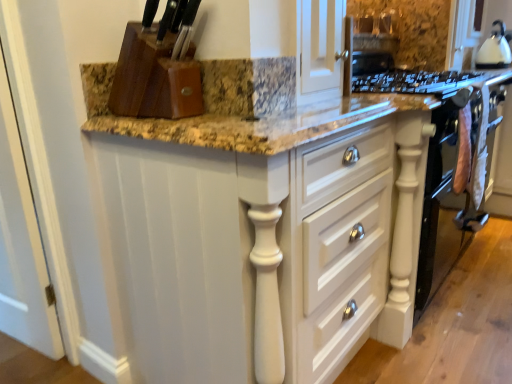
This screenshot has height=384, width=512. I want to click on white glossy kettle at upper right, so click(494, 50).

Image resolution: width=512 pixels, height=384 pixels. What do you see at coordinates (494, 50) in the screenshot? I see `white glossy kettle at upper right` at bounding box center [494, 50].

What is the approximate width of white glossy kettle at upper right?

It is 22.47 centimeters.

The image size is (512, 384). What do you see at coordinates (269, 243) in the screenshot?
I see `white painted wood cabinet at center` at bounding box center [269, 243].

At what (x,y) coordinates should I click in order to perform the action: click on white painted wood cabinet at center. Please return your answer as a coordinate pair (x, y). The height and width of the screenshot is (384, 512). Looking at the image, I should click on 269,243.

Locate an element on the screen. white glossy kettle at upper right is located at coordinates point(494,50).

Is white painted wood cabinet at center to the right of white glossy kettle at upper right from the viewer's perspective?

Incorrect, white painted wood cabinet at center is not on the right side of white glossy kettle at upper right.

Which object is further away from the camera, white painted wood cabinet at center or white glossy kettle at upper right?

white glossy kettle at upper right is further away from the camera.

Which is farther from the camera, (238, 356) or (500, 58)?

The point (500, 58) is farther.

From the image's perspective, is white painted wood cabinet at center above or below white glossy kettle at upper right?

white painted wood cabinet at center is situated lower than white glossy kettle at upper right in the image.

From a real-world perspective, is white painted wood cabinet at center on top of white glossy kettle at upper right?

No, from a real-world perspective, white painted wood cabinet at center is not on top of white glossy kettle at upper right.

Which object is thinner, white painted wood cabinet at center or white glossy kettle at upper right?

Thinner between the two is white glossy kettle at upper right.

In terms of height, does white painted wood cabinet at center look taller or shorter compared to white glossy kettle at upper right?

Clearly, white painted wood cabinet at center is taller compared to white glossy kettle at upper right.

Considering the sizes of white painted wood cabinet at center and white glossy kettle at upper right in the image, is white painted wood cabinet at center bigger or smaller than white glossy kettle at upper right?

In the image, white painted wood cabinet at center appears to be larger than white glossy kettle at upper right.

Is white painted wood cabinet at center surrounding white glossy kettle at upper right?

Definitely not — white glossy kettle at upper right is not inside white painted wood cabinet at center.

Is white painted wood cabinet at center beside white glossy kettle at upper right?

white painted wood cabinet at center and white glossy kettle at upper right are not in contact.

Is white painted wood cabinet at center positioned with its back to white glossy kettle at upper right?

No, white painted wood cabinet at center's orientation is not away from white glossy kettle at upper right.

What's the angular difference between white painted wood cabinet at center and white glossy kettle at upper right's facing directions?

white painted wood cabinet at center and white glossy kettle at upper right are facing 1.22 degrees away from each other.

How far apart are white painted wood cabinet at center and white glossy kettle at upper right?

white painted wood cabinet at center is 2.17 meters away from white glossy kettle at upper right.

I want to click on kitchen appliance above the white painted wood cabinet at center (from the image's perspective), so click(494, 50).

Considering the positions of objects white glossy kettle at upper right and white painted wood cabinet at center in the image provided, who is more to the left, white glossy kettle at upper right or white painted wood cabinet at center?

Positioned to the left is white painted wood cabinet at center.

In the image, is white glossy kettle at upper right positioned in front of or behind white painted wood cabinet at center?

Visually, white glossy kettle at upper right is located behind white painted wood cabinet at center.

Considering the positions of point (490, 43) and point (260, 129), is point (490, 43) closer or farther from the camera than point (260, 129)?

Point (490, 43) appears to be farther away from the viewer than point (260, 129).

From the image's perspective, which object appears higher, white glossy kettle at upper right or white painted wood cabinet at center?

white glossy kettle at upper right is shown above in the image.

From a real-world perspective, is white glossy kettle at upper right physically located above or below white painted wood cabinet at center?

Clearly, from a real-world perspective, white glossy kettle at upper right is above white painted wood cabinet at center.

Between white glossy kettle at upper right and white painted wood cabinet at center, which one has larger width?

Wider between the two is white painted wood cabinet at center.

Between white glossy kettle at upper right and white painted wood cabinet at center, which one has more height?

With more height is white painted wood cabinet at center.

Considering the sizes of white glossy kettle at upper right and white painted wood cabinet at center in the image, is white glossy kettle at upper right bigger or smaller than white painted wood cabinet at center?

Considering their sizes, white glossy kettle at upper right takes up less space than white painted wood cabinet at center.

Is white painted wood cabinet at center inside white glossy kettle at upper right?

→ Definitely not — white painted wood cabinet at center is not inside white glossy kettle at upper right.

Is white glossy kettle at upper right positioned far away from white painted wood cabinet at center?

white glossy kettle at upper right is positioned a significant distance from white painted wood cabinet at center.

Is white glossy kettle at upper right facing towards white painted wood cabinet at center?

No.

This screenshot has height=384, width=512. What are the coordinates of `kitchen appliance that is above the white painted wood cabinet at center (from a real-world perspective)` in the screenshot? It's located at (494, 50).

The width and height of the screenshot is (512, 384). What are the coordinates of `kitchen appliance located above the white painted wood cabinet at center (from a real-world perspective)` in the screenshot? It's located at (494, 50).

At what (x,y) coordinates should I click in order to perform the action: click on cabinetry located in front of the white glossy kettle at upper right. Please return your answer as a coordinate pair (x, y). The image size is (512, 384). Looking at the image, I should click on (269, 243).